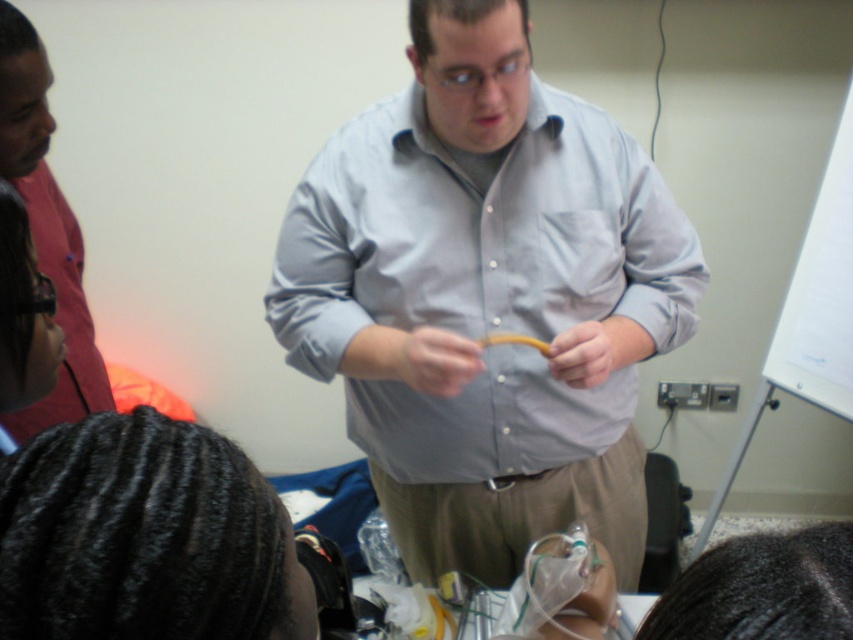
Question: Which object is closer to the camera taking this photo?

Choices:
 (A) matte yellow ring at center
 (B) yellow rubber tube at center

Answer: (B)

Question: Which object is closer to the camera taking this photo?

Choices:
 (A) matte yellow ring at center
 (B) yellow rubber tube at center
 (C) clear plastic tube at center
 (D) matte red shirt at left

Answer: (D)

Question: Which object is positioned farthest from the matte yellow ring at center?

Choices:
 (A) matte yellow pen at center
 (B) clear plastic tube at center
 (C) light blue shirt at center

Answer: (B)

Question: Can you confirm if matte yellow pen at center is positioned to the left of yellow rubber tube at center?

Choices:
 (A) no
 (B) yes

Answer: (B)

Question: Is light blue shirt at center wider than clear plastic tube at center?

Choices:
 (A) no
 (B) yes

Answer: (B)

Question: Can you confirm if matte red shirt at left is wider than matte yellow ring at center?

Choices:
 (A) no
 (B) yes

Answer: (B)